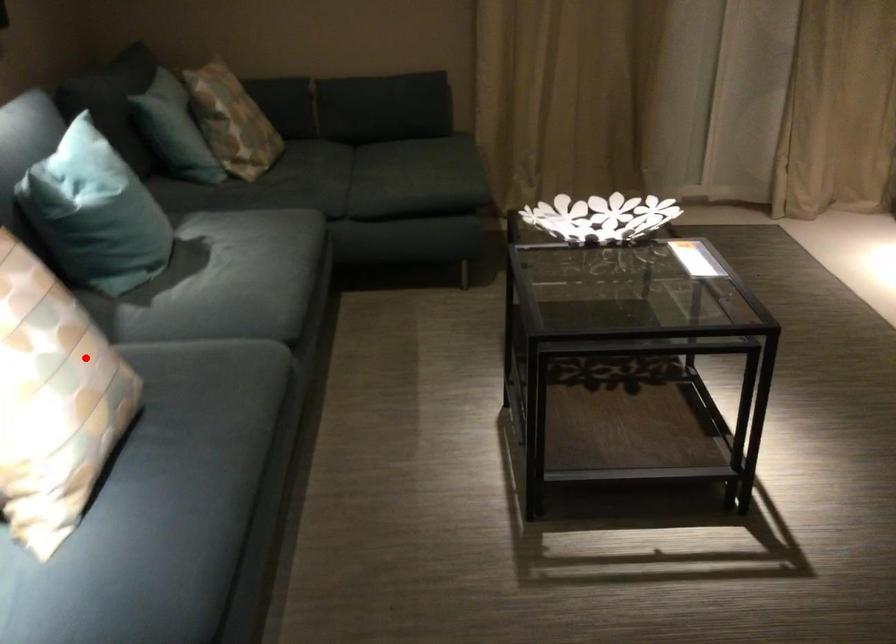
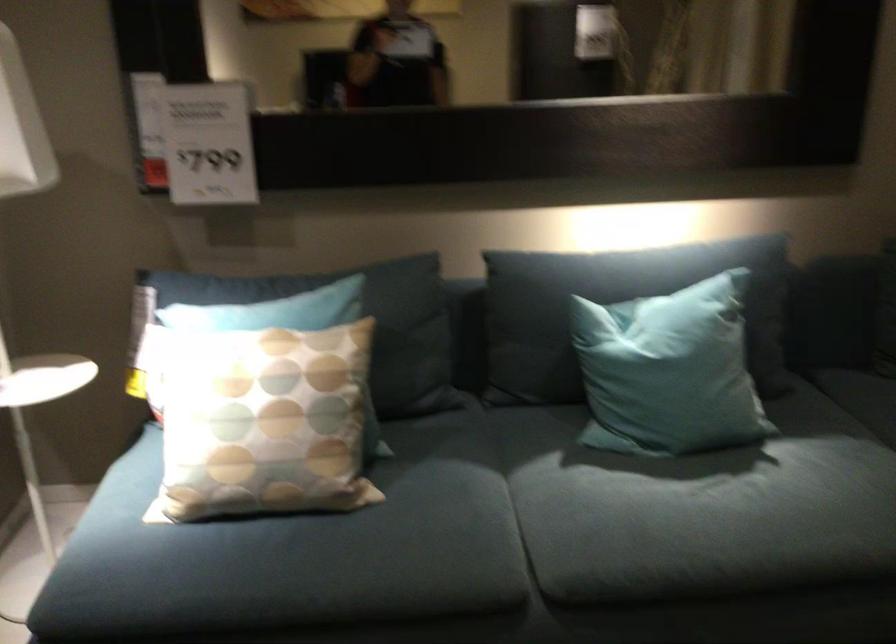
Question: I am providing you with two images of the same scene from different viewpoints. Given a red point in image1, look at the same physical point in image2. Is it:

Choices:
 (A) Closer to the viewpoint
 (B) Farther from the viewpoint

Answer: (B)